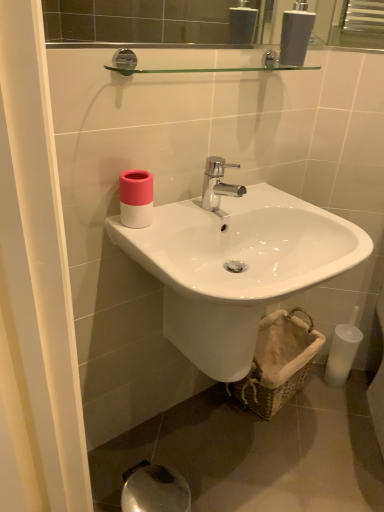
Image resolution: width=384 pixels, height=512 pixels. What do you see at coordinates (278, 362) in the screenshot? I see `brown woven basket at lower right` at bounding box center [278, 362].

Locate an element on the screen. The height and width of the screenshot is (512, 384). white glossy soap dispenser at upper center is located at coordinates (x=296, y=34).

Where is `pink matte cup at upper left`? pink matte cup at upper left is located at coordinates (136, 198).

Consider the image. Would you say brown woven basket at lower right is outside pink matte cup at upper left?

Yes, brown woven basket at lower right is located beyond the bounds of pink matte cup at upper left.

Identify the location of toiletry that is in front of the brown woven basket at lower right. This screenshot has width=384, height=512. (x=136, y=198).

Can you confirm if brown woven basket at lower right is bigger than pink matte cup at upper left?

Indeed, brown woven basket at lower right has a larger size compared to pink matte cup at upper left.

Considering the relative sizes of brown woven basket at lower right and pink matte cup at upper left in the image provided, is brown woven basket at lower right thinner than pink matte cup at upper left?

No.

Image resolution: width=384 pixels, height=512 pixels. Identify the location of soap dispenser above the white glossy sink at center (from the image's perspective). (296, 34).

From a real-world perspective, between white glossy sink at center and white glossy soap dispenser at upper center, who is vertically higher?

From a 3D spatial view, white glossy soap dispenser at upper center is above.

Looking at the image, does white glossy sink at center seem bigger or smaller compared to white glossy soap dispenser at upper center?

Clearly, white glossy sink at center is larger in size than white glossy soap dispenser at upper center.

Is white glossy sink at center to the right of white glossy soap dispenser at upper center from the viewer's perspective?

In fact, white glossy sink at center is to the left of white glossy soap dispenser at upper center.

Is point (306, 41) closer to viewer compared to point (339, 217)?

Yes.

Considering the sizes of objects white glossy soap dispenser at upper center and white glossy sink at center in the image provided, who is taller, white glossy soap dispenser at upper center or white glossy sink at center?

white glossy sink at center.

From a real-world perspective, which object rests below the other?

From a 3D spatial view, white glossy sink at center is below.

Do you think white glossy soap dispenser at upper center is within white glossy sink at center, or outside of it?

white glossy soap dispenser at upper center is outside white glossy sink at center.

Is white glossy soap dispenser at upper center not near brown woven basket at lower right?

That's right, there is a large distance between white glossy soap dispenser at upper center and brown woven basket at lower right.

Considering the sizes of objects white glossy soap dispenser at upper center and brown woven basket at lower right in the image provided, who is thinner, white glossy soap dispenser at upper center or brown woven basket at lower right?

white glossy soap dispenser at upper center.

From a real-world perspective, between white glossy soap dispenser at upper center and brown woven basket at lower right, who is vertically higher?

white glossy soap dispenser at upper center is physically above.

Is white glossy sink at center positioned far away from brown woven basket at lower right?

No, white glossy sink at center is not far from brown woven basket at lower right.

From a real-world perspective, is white glossy sink at center on brown woven basket at lower right?

Indeed, from a real-world perspective, white glossy sink at center stands above brown woven basket at lower right.

From the image's perspective, is white glossy sink at center located above or below brown woven basket at lower right?

white glossy sink at center is situated higher than brown woven basket at lower right in the image.

Does point (210, 238) come closer to viewer compared to point (121, 199)?

No, (210, 238) is further to viewer.

How different are the orientations of white glossy sink at center and pink matte cup at upper left in degrees?

1.35 degrees separate the facing orientations of white glossy sink at center and pink matte cup at upper left.

Locate an element on the screen. toiletry behind the white glossy sink at center is located at coordinates (136, 198).

Consider the image. What's the angular difference between brown woven basket at lower right and white glossy soap dispenser at upper center's facing directions?

They differ by 6.46 degrees in their facing directions.

Is brown woven basket at lower right in front of or behind white glossy soap dispenser at upper center in the image?

brown woven basket at lower right is behind white glossy soap dispenser at upper center.

Is brown woven basket at lower right smaller than white glossy soap dispenser at upper center?

Actually, brown woven basket at lower right might be larger than white glossy soap dispenser at upper center.

Does point (274, 317) come behind point (286, 36)?

Yes, it is behind point (286, 36).

Find the location of a particular element. Image resolution: width=384 pixels, height=512 pixels. toiletry that appears above the brown woven basket at lower right (from the image's perspective) is located at coordinates (136, 198).

In the image, there is a white glossy soap dispenser at upper center. Identify the location of sink below it (from the image's perspective). (236, 267).

From the picture: When comparing their distances from white glossy sink at center, does brown woven basket at lower right or white glossy soap dispenser at upper center seem further?

white glossy soap dispenser at upper center lies further to white glossy sink at center than the other object.

When comparing their distances from pink matte cup at upper left, does brown woven basket at lower right or white glossy soap dispenser at upper center seem further?

brown woven basket at lower right.

Based on their spatial positions, is brown woven basket at lower right or pink matte cup at upper left further from white glossy soap dispenser at upper center?

Based on the image, brown woven basket at lower right appears to be further to white glossy soap dispenser at upper center.

Looking at the image, which one is located closer to white glossy soap dispenser at upper center, pink matte cup at upper left or brown woven basket at lower right?

The object closer to white glossy soap dispenser at upper center is pink matte cup at upper left.

In the scene shown: Based on their spatial positions, is white glossy sink at center or white glossy soap dispenser at upper center closer to pink matte cup at upper left?

Among the two, white glossy sink at center is located nearer to pink matte cup at upper left.

Estimate the real-world distances between objects in this image. Which object is further from brown woven basket at lower right, white glossy soap dispenser at upper center or pink matte cup at upper left?

The object further to brown woven basket at lower right is white glossy soap dispenser at upper center.

Considering their positions, is brown woven basket at lower right positioned further to white glossy soap dispenser at upper center than white glossy sink at center?

Based on the image, brown woven basket at lower right appears to be further to white glossy soap dispenser at upper center.

Considering their positions, is white glossy soap dispenser at upper center positioned further to brown woven basket at lower right than white glossy sink at center?

white glossy soap dispenser at upper center is further to brown woven basket at lower right.

Find the location of `toiletry between white glossy soap dispenser at upper center and white glossy sink at center in the up-down direction`. toiletry between white glossy soap dispenser at upper center and white glossy sink at center in the up-down direction is located at coordinates (136, 198).

Find the location of a particular element. toiletry positioned between white glossy sink at center and brown woven basket at lower right from near to far is located at coordinates (136, 198).

The height and width of the screenshot is (512, 384). Identify the location of toiletry that lies between white glossy soap dispenser at upper center and brown woven basket at lower right from top to bottom. (136, 198).

The width and height of the screenshot is (384, 512). I want to click on sink that lies between white glossy soap dispenser at upper center and brown woven basket at lower right from top to bottom, so click(236, 267).